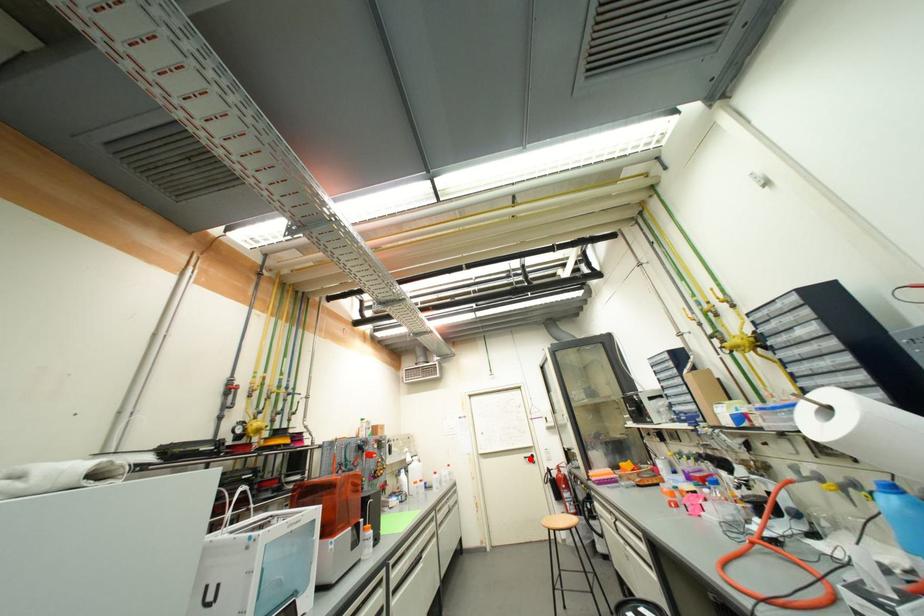
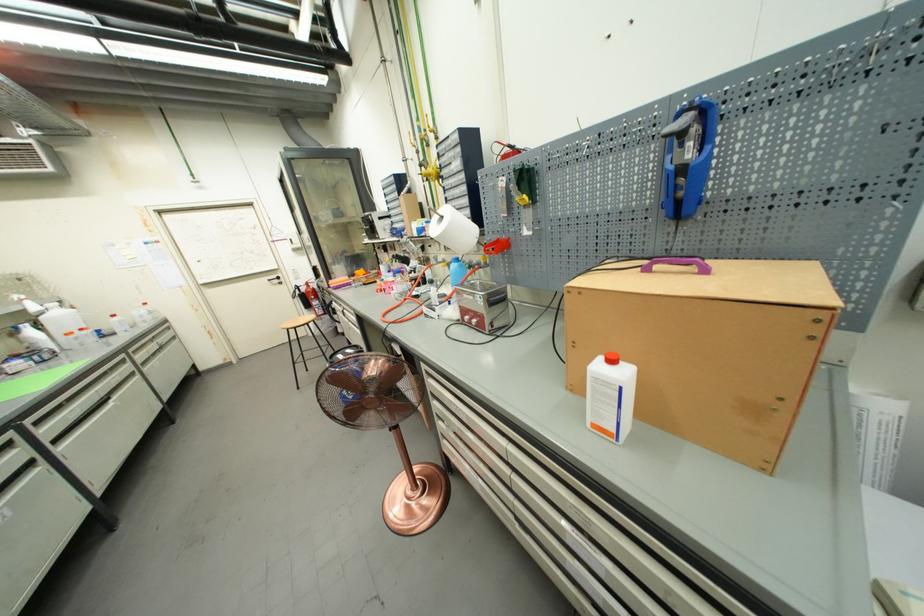
The point at the highlighted location is marked in the first image. Where is the corresponding point in the second image?

(274, 282)